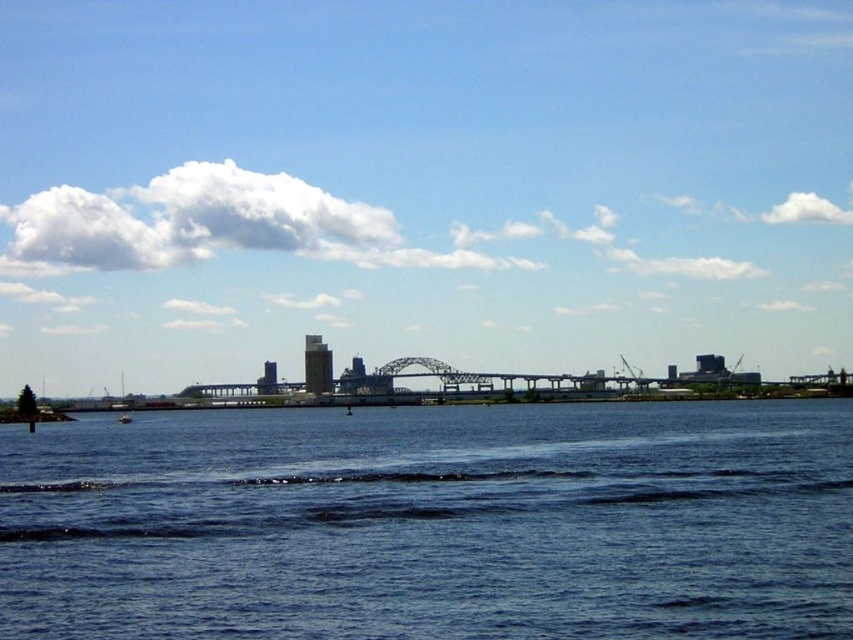
Is blue sky at upper center closer to the viewer compared to blue water at lower center?

No, blue sky at upper center is behind blue water at lower center.

Can you confirm if blue sky at upper center is taller than blue water at lower center?

Yes.

Does point (550, 113) lie in front of point (288, 442)?

No, (550, 113) is behind (288, 442).

In order to click on blue sky at upper center in this screenshot , I will do `click(421, 184)`.

Find the location of a particular element. blue water at lower center is located at coordinates (433, 524).

From the picture: Does blue water at lower center have a larger size compared to white plastic boat at lower left?

Yes.

Is point (654, 609) farther from camera compared to point (129, 420)?

No.

The height and width of the screenshot is (640, 853). In order to click on blue water at lower center in this screenshot , I will do `click(433, 524)`.

Between blue sky at upper center and white plastic boat at lower left, which one has more height?

Standing taller between the two is blue sky at upper center.

What do you see at coordinates (421, 184) in the screenshot?
I see `blue sky at upper center` at bounding box center [421, 184].

I want to click on blue sky at upper center, so click(421, 184).